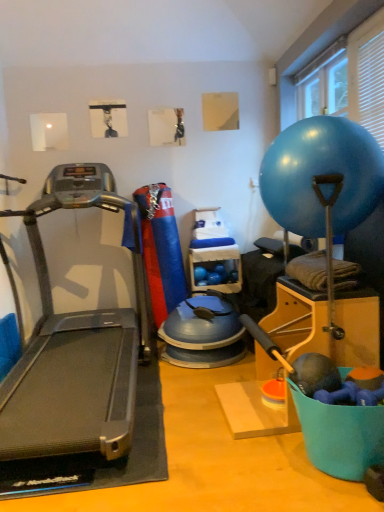
Question: Is transparent plastic window screen at upper right not near silver metallic treadmill at left?

Choices:
 (A) yes
 (B) no

Answer: (A)

Question: From the image's perspective, would you say transparent plastic window screen at upper right is positioned over silver metallic treadmill at left?

Choices:
 (A) no
 (B) yes

Answer: (B)

Question: Is transparent plastic window screen at upper right positioned before silver metallic treadmill at left?

Choices:
 (A) yes
 (B) no

Answer: (B)

Question: Is transparent plastic window screen at upper right aimed at silver metallic treadmill at left?

Choices:
 (A) no
 (B) yes

Answer: (A)

Question: Can you confirm if transparent plastic window screen at upper right is wider than silver metallic treadmill at left?

Choices:
 (A) yes
 (B) no

Answer: (B)

Question: Does transparent plastic window screen at upper right have a larger size compared to silver metallic treadmill at left?

Choices:
 (A) no
 (B) yes

Answer: (A)

Question: From the image's perspective, is clear plastic container at center over silver metallic treadmill at left?

Choices:
 (A) no
 (B) yes

Answer: (A)

Question: Is clear plastic container at center to the right of silver metallic treadmill at left from the viewer's perspective?

Choices:
 (A) no
 (B) yes

Answer: (B)

Question: Is clear plastic container at center next to silver metallic treadmill at left and touching it?

Choices:
 (A) yes
 (B) no

Answer: (B)

Question: Can you confirm if clear plastic container at center is positioned to the left of silver metallic treadmill at left?

Choices:
 (A) no
 (B) yes

Answer: (A)

Question: From the image's perspective, is clear plastic container at center below silver metallic treadmill at left?

Choices:
 (A) no
 (B) yes

Answer: (B)

Question: Is clear plastic container at center smaller than silver metallic treadmill at left?

Choices:
 (A) no
 (B) yes

Answer: (B)

Question: Considering the relative positions of clear plastic container at center and blue rubber ball at upper right in the image provided, is clear plastic container at center to the left of blue rubber ball at upper right from the viewer's perspective?

Choices:
 (A) yes
 (B) no

Answer: (A)